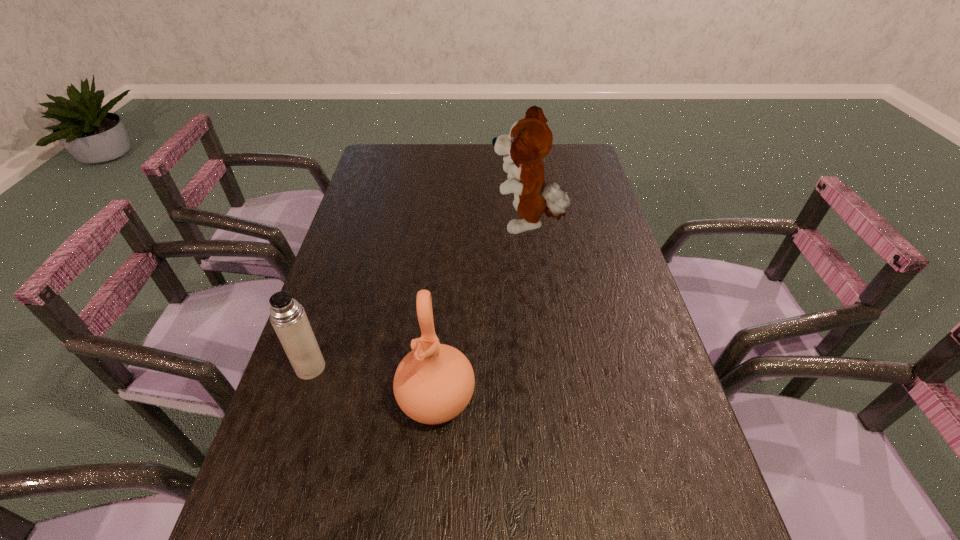
Where is `the tallest object`? The height and width of the screenshot is (540, 960). the tallest object is located at coordinates (530, 139).

You are a GUI agent. You are given a task and a screenshot of the screen. Output one action in this format:
    pyautogui.click(x=<x>, y=<y>)
    Task: Click on the farthest object
    This screenshot has width=960, height=540.
    Given the screenshot: What is the action you would take?
    pyautogui.click(x=530, y=139)

Find the location of a particular element. the second object from left to right is located at coordinates (433, 384).

Find the location of a particular element. The width and height of the screenshot is (960, 540). the second shortest object is located at coordinates (433, 384).

Find the location of a particular element. thermos bottle is located at coordinates (288, 318).

I want to click on the leftmost object, so click(288, 318).

In order to click on vacant area located 0.260m on the face of the rightmost object in this screenshot , I will do `click(407, 225)`.

Where is `blank space located 0.230m on the face of the rightmost object`? This screenshot has height=540, width=960. blank space located 0.230m on the face of the rightmost object is located at coordinates (417, 225).

I want to click on vacant space located 0.220m on the face of the rightmost object, so click(420, 225).

This screenshot has height=540, width=960. I want to click on vacant point located 0.110m on the spout of the second tallest object, so click(429, 495).